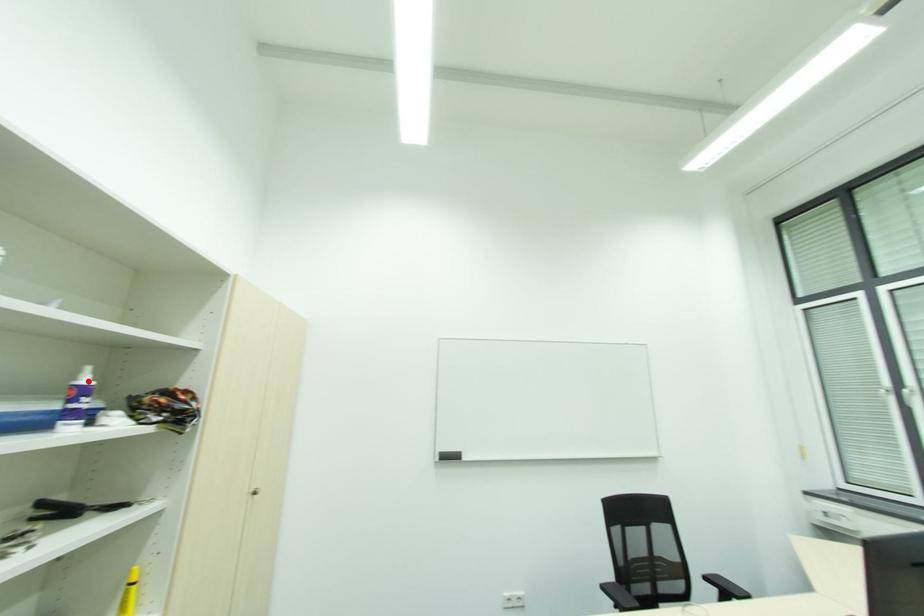
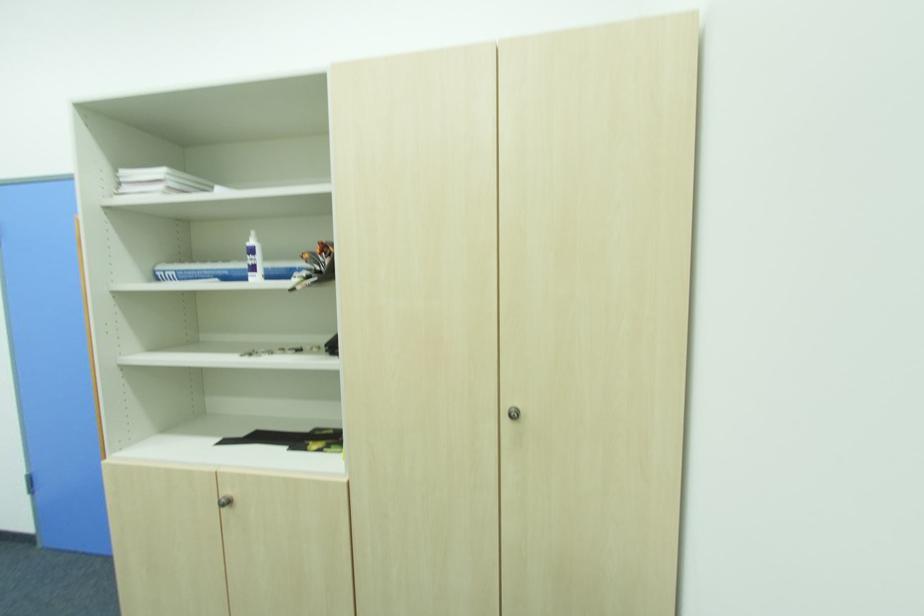
Locate, in the second image, the point that corresponds to the highlighted location in the first image.

(254, 243)